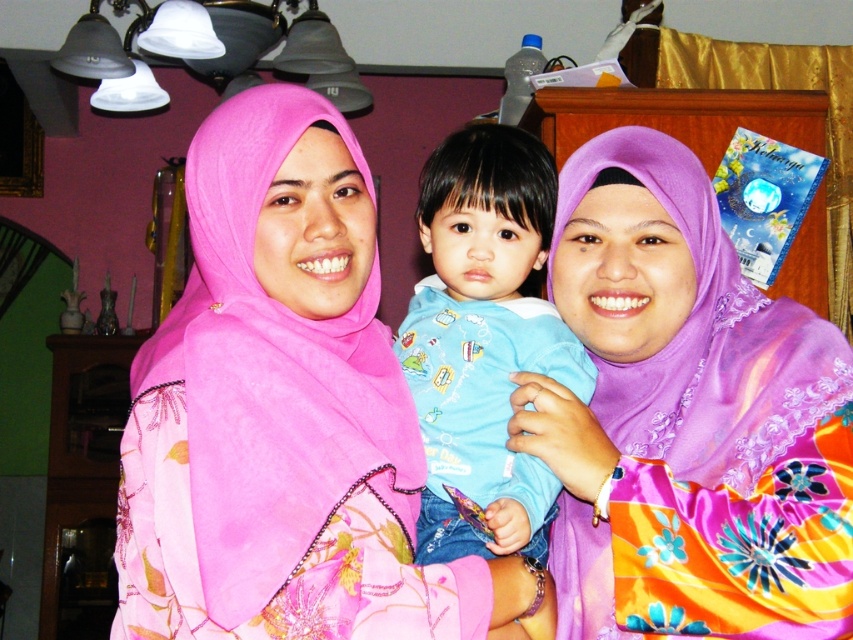
Question: Estimate the real-world distances between objects in this image. Which object is closer to the purple satin hijab at center?

Choices:
 (A) blue cotton shirt at center
 (B) pink satin hijab at center

Answer: (A)

Question: Observing the image, what is the correct spatial positioning of purple satin hijab at center in reference to blue cotton shirt at center?

Choices:
 (A) below
 (B) above

Answer: (A)

Question: Which of the following is the closest to the observer?

Choices:
 (A) purple satin hijab at center
 (B) blue cotton shirt at center
 (C) pink satin hijab at center

Answer: (C)

Question: Does pink satin hijab at center appear under blue cotton shirt at center?

Choices:
 (A) yes
 (B) no

Answer: (A)

Question: Among these objects, which one is farthest from the camera?

Choices:
 (A) purple satin hijab at center
 (B) blue cotton shirt at center

Answer: (B)

Question: Does purple satin hijab at center lie in front of blue cotton shirt at center?

Choices:
 (A) no
 (B) yes

Answer: (B)